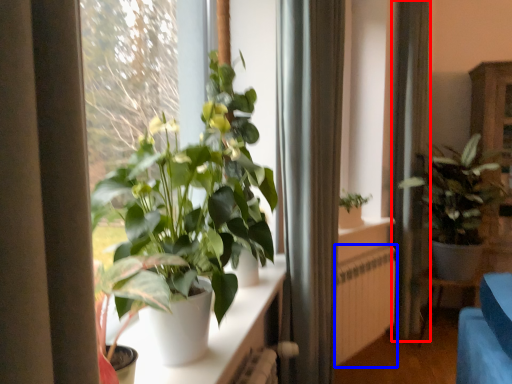
Question: Which point is closer to the camera, curtain (highlighted by a red box) or radiator (highlighted by a blue box)?

Choices:
 (A) curtain
 (B) radiator

Answer: (B)